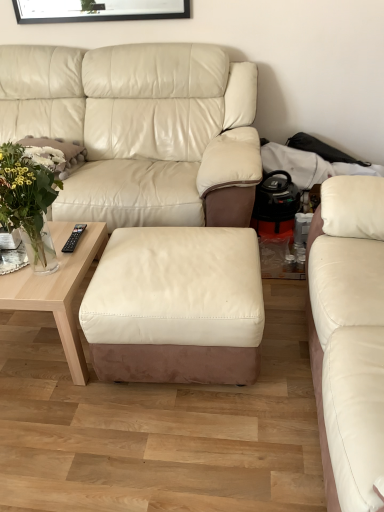
This screenshot has width=384, height=512. What do you see at coordinates (137, 126) in the screenshot? I see `matte leather couch at center, the second studio couch positioned from the right` at bounding box center [137, 126].

This screenshot has width=384, height=512. Identify the location of white fluffy pillow at left. (55, 154).

Where is `white leather ottoman at center`? The image size is (384, 512). white leather ottoman at center is located at coordinates (176, 306).

This screenshot has height=512, width=384. Describe the element at coordinates (28, 203) in the screenshot. I see `translucent glass vase at upper left` at that location.

Locate an element on the screen. light wood coffee table at lower left is located at coordinates (57, 289).

What do you see at coordinates (348, 337) in the screenshot? The width and height of the screenshot is (384, 512). I see `matte white leather couch at right, the 2th studio couch from the left` at bounding box center [348, 337].

Identify the location of matte leather couch at center, the second studio couch positioned from the right. This screenshot has height=512, width=384. (137, 126).

From the image's perspective, is translucent glass vase at upper left below light wood coffee table at lower left?

Actually, translucent glass vase at upper left appears above light wood coffee table at lower left in the image.

Looking at this image, could you tell me if translucent glass vase at upper left is turned towards light wood coffee table at lower left?

No, translucent glass vase at upper left is not oriented towards light wood coffee table at lower left.

Considering the points (34, 197) and (65, 348), which point is behind, point (34, 197) or point (65, 348)?

Positioned behind is point (65, 348).

Is matte leather couch at center, which ranks as the 1th studio couch in left-to-right order, positioned with its back to white fluffy pillow at left?

Yes, matte leather couch at center, which ranks as the 1th studio couch in left-to-right order, is facing away from white fluffy pillow at left.

Measure the distance from matte leather couch at center, which ranks as the 1th studio couch in left-to-right order, to white fluffy pillow at left.

matte leather couch at center, which ranks as the 1th studio couch in left-to-right order, and white fluffy pillow at left are 17.02 inches apart from each other.

Does matte leather couch at center, which ranks as the 1th studio couch in left-to-right order, lie behind white fluffy pillow at left?

No, matte leather couch at center, which ranks as the 1th studio couch in left-to-right order, is closer to the viewer.

Is matte leather couch at center, which ranks as the 1th studio couch in left-to-right order, at the right side of white fluffy pillow at left?

Yes.

Considering the relative sizes of white leather ottoman at center and matte leather couch at center, the second studio couch positioned from the right, in the image provided, is white leather ottoman at center shorter than matte leather couch at center, the second studio couch positioned from the right,?

Indeed, white leather ottoman at center has a lesser height compared to matte leather couch at center, the second studio couch positioned from the right.

Is point (112, 304) positioned in front of point (162, 155)?

Yes, it is in front of point (162, 155).

From a real-world perspective, is white leather ottoman at center physically above matte leather couch at center, which ranks as the 1th studio couch in left-to-right order?

No, from a real-world perspective, white leather ottoman at center is not above matte leather couch at center, which ranks as the 1th studio couch in left-to-right order.

In the image, is white leather ottoman at center on the left side or the right side of matte leather couch at center, which ranks as the 1th studio couch in left-to-right order?

white leather ottoman at center is positioned on matte leather couch at center, which ranks as the 1th studio couch in left-to-right order,'s right side.

Between white fluffy pillow at left and matte white leather couch at right, marked as the first studio couch in a right-to-left arrangement, which one has larger width?

Wider between the two is matte white leather couch at right, marked as the first studio couch in a right-to-left arrangement.

Which object is closer to the camera taking this photo, white fluffy pillow at left or matte white leather couch at right, the 2th studio couch from the left?

matte white leather couch at right, the 2th studio couch from the left, is closer to the camera.

From a real-world perspective, which is physically below, white fluffy pillow at left or matte white leather couch at right, marked as the first studio couch in a right-to-left arrangement?

white fluffy pillow at left is physically lower.

Where is `studio couch above the white fluffy pillow at left (from a real-world perspective)`? The height and width of the screenshot is (512, 384). studio couch above the white fluffy pillow at left (from a real-world perspective) is located at coordinates (348, 337).

Can you see matte white leather couch at right, marked as the first studio couch in a right-to-left arrangement, touching white fluffy pillow at left?

No, matte white leather couch at right, marked as the first studio couch in a right-to-left arrangement, is not with white fluffy pillow at left.

Which is correct: matte white leather couch at right, marked as the first studio couch in a right-to-left arrangement, is inside white fluffy pillow at left, or outside of it?

matte white leather couch at right, marked as the first studio couch in a right-to-left arrangement, is not enclosed by white fluffy pillow at left.

In terms of size, does light wood coffee table at lower left appear bigger or smaller than white leather ottoman at center?

Clearly, light wood coffee table at lower left is smaller in size than white leather ottoman at center.

Is light wood coffee table at lower left surrounding white leather ottoman at center?

Actually, white leather ottoman at center is outside light wood coffee table at lower left.

Locate an element on the screen. The height and width of the screenshot is (512, 384). stool in front of the light wood coffee table at lower left is located at coordinates (176, 306).

How different are the orientations of light wood coffee table at lower left and white leather ottoman at center in degrees?

light wood coffee table at lower left and white leather ottoman at center are facing 1.35 degrees away from each other.

How different are the orientations of light wood coffee table at lower left and black matte picture frame at upper center in degrees?

They differ by 1.74 degrees in their facing directions.

Based on the photo, is black matte picture frame at upper center at the back of light wood coffee table at lower left?

No, light wood coffee table at lower left's orientation is not away from black matte picture frame at upper center.

Which object is positioned more to the left, light wood coffee table at lower left or black matte picture frame at upper center?

light wood coffee table at lower left is more to the left.

This screenshot has width=384, height=512. I want to click on coffee table below the translucent glass vase at upper left (from a real-world perspective), so click(57, 289).

Where is `pillow that appears on the left of matte leather couch at center, which ranks as the 1th studio couch in left-to-right order`? The height and width of the screenshot is (512, 384). pillow that appears on the left of matte leather couch at center, which ranks as the 1th studio couch in left-to-right order is located at coordinates (55, 154).

When comparing their distances from white fluffy pillow at left, does light wood coffee table at lower left or black matte picture frame at upper center seem further?

black matte picture frame at upper center lies further to white fluffy pillow at left than the other object.

Looking at the image, which one is located further to matte white leather couch at right, the 2th studio couch from the left, black matte picture frame at upper center or light wood coffee table at lower left?

black matte picture frame at upper center is further to matte white leather couch at right, the 2th studio couch from the left.

Estimate the real-world distances between objects in this image. Which object is further from matte white leather couch at right, the 2th studio couch from the left, light wood coffee table at lower left or black matte picture frame at upper center?

black matte picture frame at upper center is positioned further to the anchor matte white leather couch at right, the 2th studio couch from the left.

In the scene shown: Estimate the real-world distances between objects in this image. Which object is further from black matte picture frame at upper center, light wood coffee table at lower left or matte leather couch at center, which ranks as the 1th studio couch in left-to-right order?

The object further to black matte picture frame at upper center is light wood coffee table at lower left.

Which object lies further to the anchor point matte white leather couch at right, the 2th studio couch from the left, white fluffy pillow at left or white leather ottoman at center?

Result: The object further to matte white leather couch at right, the 2th studio couch from the left, is white fluffy pillow at left.

Based on their spatial positions, is black matte picture frame at upper center or matte white leather couch at right, the 2th studio couch from the left, closer to light wood coffee table at lower left?

Among the two, matte white leather couch at right, the 2th studio couch from the left, is located nearer to light wood coffee table at lower left.

From the image, which object appears to be farther from matte leather couch at center, the second studio couch positioned from the right, white fluffy pillow at left or light wood coffee table at lower left?

light wood coffee table at lower left lies further to matte leather couch at center, the second studio couch positioned from the right, than the other object.

From the image, which object appears to be farther from black matte picture frame at upper center, white leather ottoman at center or light wood coffee table at lower left?

Based on the image, white leather ottoman at center appears to be further to black matte picture frame at upper center.

The image size is (384, 512). Identify the location of stool located between matte white leather couch at right, marked as the first studio couch in a right-to-left arrangement, and white fluffy pillow at left in the depth direction. (176, 306).

Locate an element on the screen. studio couch located between matte white leather couch at right, the 2th studio couch from the left, and black matte picture frame at upper center in the depth direction is located at coordinates (137, 126).

At what (x,y) coordinates should I click in order to perform the action: click on studio couch located between matte white leather couch at right, the 2th studio couch from the left, and white fluffy pillow at left in the depth direction. Please return your answer as a coordinate pair (x, y). Looking at the image, I should click on (137, 126).

The image size is (384, 512). I want to click on coffee table between matte leather couch at center, which ranks as the 1th studio couch in left-to-right order, and white leather ottoman at center in the up-down direction, so click(x=57, y=289).